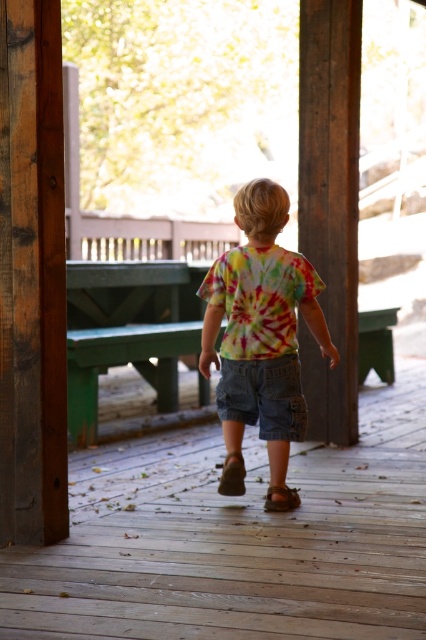
From the picture: Who is more distant from viewer, [394,532] or [305,401]?

The point [305,401] is behind.

Can you confirm if wooden deck at center is shorter than denim shorts at center?

Yes.

Describe the element at coordinates (238, 540) in the screenshot. The height and width of the screenshot is (640, 426). I see `wooden deck at center` at that location.

Locate an element on the screen. wooden deck at center is located at coordinates (238, 540).

Between point (279, 428) and point (278, 512), which one is positioned behind?

Point (279, 428)

The image size is (426, 640). What are the coordinates of `tie-dye fabric shirt at center` in the screenshot? It's located at (259, 333).

Between point (317, 36) and point (287, 387), which one is positioned behind?

The point (317, 36) is behind.

Is point (354, 48) farther from camera compared to point (284, 376)?

Yes.

The image size is (426, 640). Find the location of `wooden post at center`. wooden post at center is located at coordinates (330, 204).